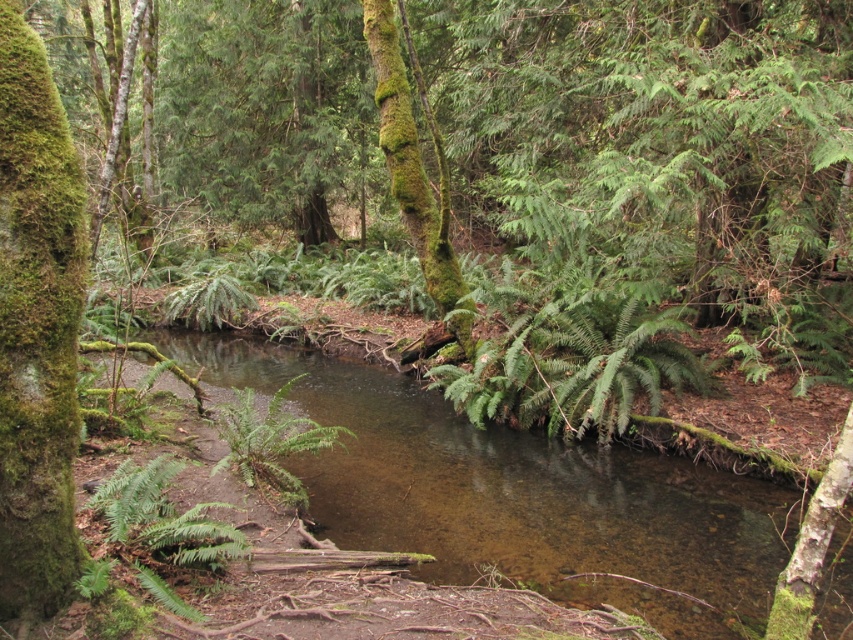
You are a hiker who wants to cross the stream safely. You notice two landmarks marked as point A and point B, corresponding to the coordinates given in the image. If point A is at point [149,362] and point B is at point [252,472], which point is closer to your current position if you are standing behind both points?

Point B at [252,472] is closer to your current position because point A at [149,362] is behind point B.

You are a hiker trying to cross the clear water stream at center. There is a green mossy tree trunk at left nearby. Which object is closer to you as you stand on the bank preparing to cross?

The clear water stream at center is closer to you than the green mossy tree trunk at left because the tree trunk is positioned behind the stream.